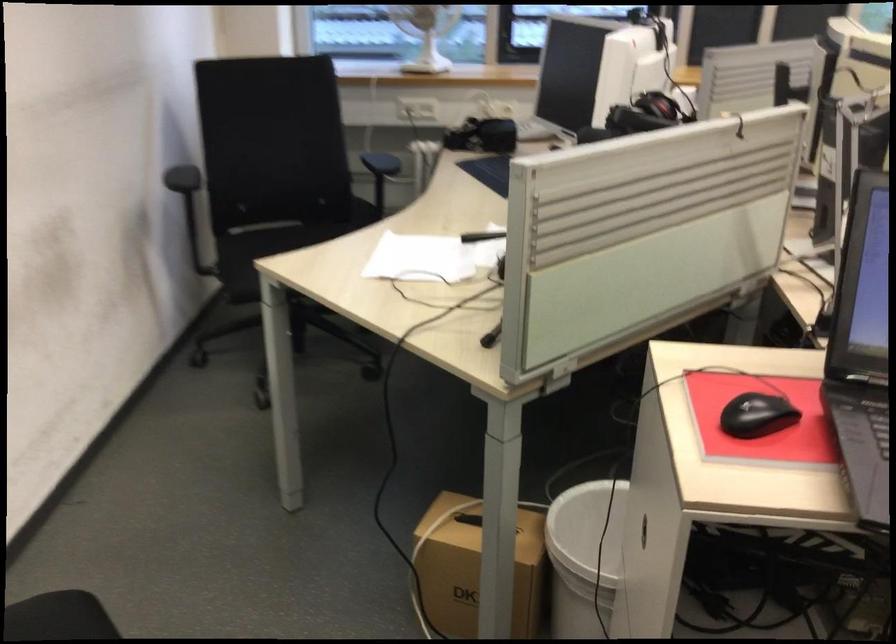
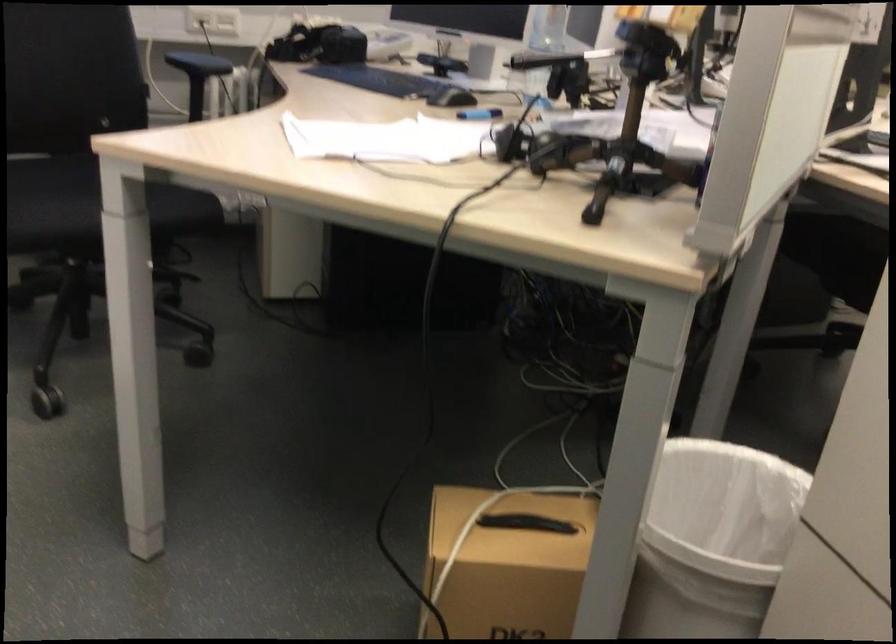
Question: How did the camera likely rotate?

Choices:
 (A) Left
 (B) Right
 (C) Up
 (D) Down

Answer: (B)